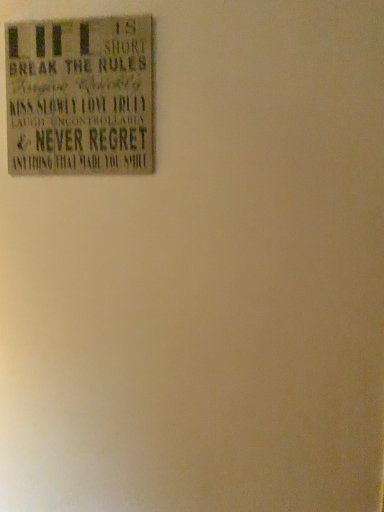
Describe the element at coordinates (80, 96) in the screenshot. I see `distressed wood sign at upper left` at that location.

Where is `distressed wood sign at upper left`? The image size is (384, 512). distressed wood sign at upper left is located at coordinates (80, 96).

The height and width of the screenshot is (512, 384). What are the coordinates of `distressed wood sign at upper left` in the screenshot? It's located at (80, 96).